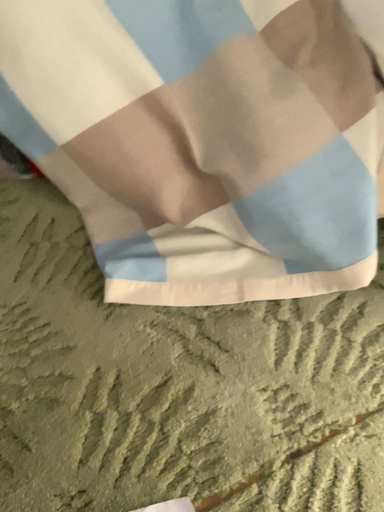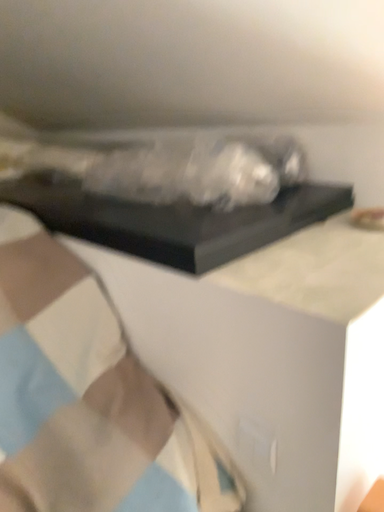
Question: How did the camera likely rotate when shooting the video?

Choices:
 (A) rotated downward
 (B) rotated upward

Answer: (B)